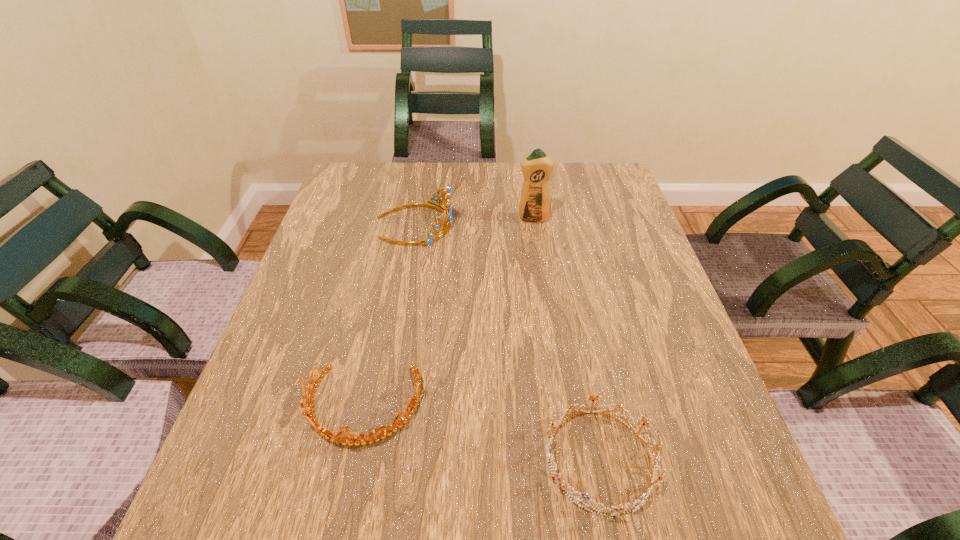
I want to click on the second closest object to the third shortest object, so coord(338,438).

Choose which object is the second nearest neighbor to the third tallest object. Please provide its 2D coordinates. Your answer should be formatted as a tuple, i.e. [(x, y)], where the tuple contains the x and y coordinates of a point satisfying the conditions above.

[(447, 211)]

I want to click on tiara that is the closest to the tallest tiara, so click(x=338, y=438).

Select which tiara is the second closest to the detergent. Please provide its 2D coordinates. Your answer should be formatted as a tuple, i.e. [(x, y)], where the tuple contains the x and y coordinates of a point satisfying the conditions above.

[(338, 438)]

Locate an element on the screen. This screenshot has width=960, height=540. free spot that satisfies the following two spatial constraints: 1. on the front-facing side of the farthest tiara; 2. on the front-facing side of the third tallest object is located at coordinates (383, 406).

Image resolution: width=960 pixels, height=540 pixels. What are the coordinates of `free space that satisfies the following two spatial constraints: 1. on the front-facing side of the farthest tiara; 2. on the front-facing side of the second shortest tiara` in the screenshot? It's located at (383, 406).

At what (x,y) coordinates should I click in order to perform the action: click on vacant space that satisfies the following two spatial constraints: 1. on the front-facing side of the second tallest object; 2. on the front-facing side of the second tallest tiara. Please return your answer as a coordinate pair (x, y). Looking at the image, I should click on (383, 406).